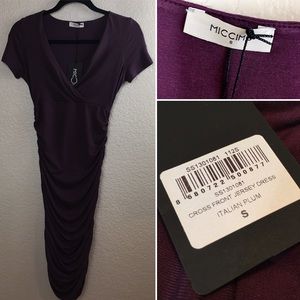
What are the coordinates of `wall` in the screenshot? It's located at (118, 226).